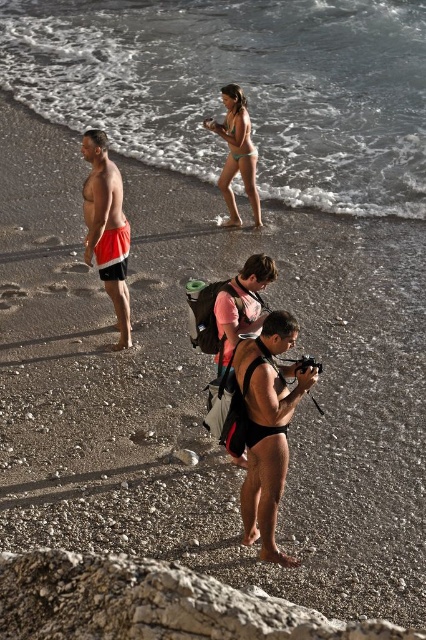
You are a photographer trying to capture the pink matte wetsuit at center and the clear water at upper center in a single shot. Which object should you focus on first if you want to ensure both are in frame?

The clear water at upper center is bigger than the pink matte wetsuit at center, so focusing on the larger clear water at upper center first will help ensure both objects are within the frame.

You are a photographer trying to capture a photo of the matte green bikini at center and the pink matte wetsuit at center. Based on their positions, which one is higher in the frame?

The matte green bikini at center is above the pink matte wetsuit at center, so it is higher in the frame.

You are a photographer trying to capture the pink matte wetsuit at center and the clear water at upper center in the same frame. Based on their positions, which object should you focus on first to ensure both are in the shot?

You should focus on the pink matte wetsuit at center first because the clear water at upper center is to the right of it, so adjusting the frame to include both would require starting with the wetsuit and expanding towards the right to include the water.